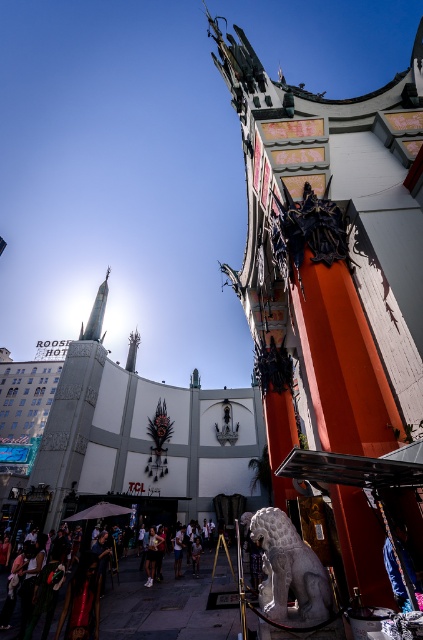
You are standing in front of the TCL Chinese Theatre and want to take a photo of the dark bronze statue at upper center. If your camera has a maximum focus range of 30 meters, will it be able to capture the statue clearly?

The dark bronze statue at upper center and viewer are 29.24 meters apart. Since the distance is within the camera maximum focus range of 30 meters, the camera can capture the statue clearly.

You are a photographer standing in front of the TCL Chinese Theatre. You notice a dark bronze statue at upper center and a white cotton shirt at center. Which object is shorter in height?

The dark bronze statue at upper center is shorter than the white cotton shirt at center.